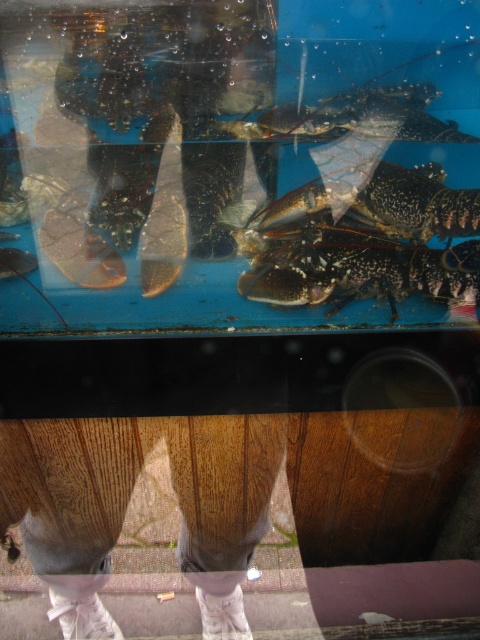
Question: Does speckled shell lobster at center have a lesser width compared to shiny black lobster at upper center?

Choices:
 (A) no
 (B) yes

Answer: (A)

Question: Can you confirm if speckled shell lobster at center is thinner than shiny black lobster at upper center?

Choices:
 (A) no
 (B) yes

Answer: (A)

Question: Which of the following is the farthest from the observer?

Choices:
 (A) (423, 140)
 (B) (448, 273)

Answer: (B)

Question: Can you confirm if speckled shell lobster at center is thinner than shiny black lobster at upper center?

Choices:
 (A) yes
 (B) no

Answer: (B)

Question: Which point is farther from the camera taking this photo?

Choices:
 (A) (288, 291)
 (B) (410, 93)

Answer: (A)